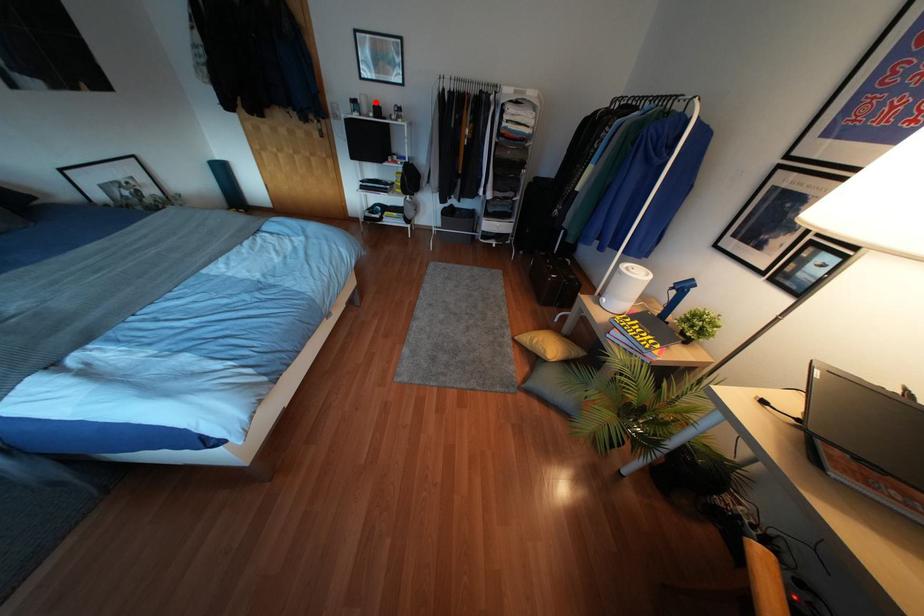
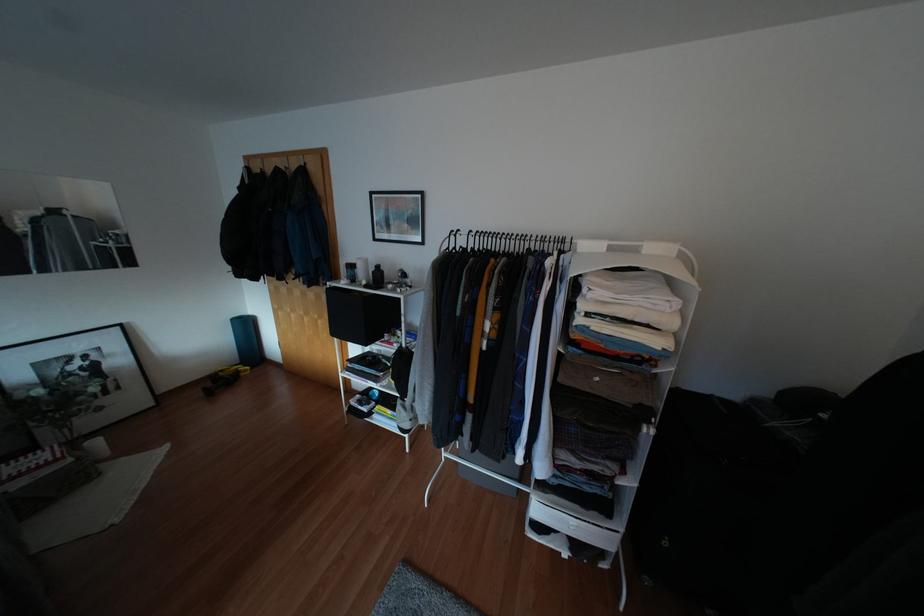
The point at the highlighted location is marked in the first image. Where is the corresponding point in the second image?

(377, 265)